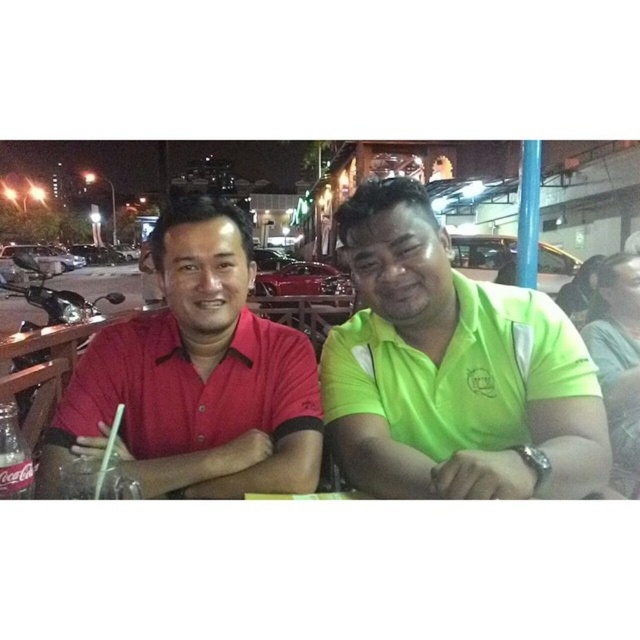
Is green matte shirt at center to the left of matte red shirt at left from the viewer's perspective?

Incorrect, green matte shirt at center is not on the left side of matte red shirt at left.

Between point (403, 342) and point (282, 381), which one is positioned behind?

Point (282, 381)

The width and height of the screenshot is (640, 640). Identify the location of green matte shirt at center. (452, 371).